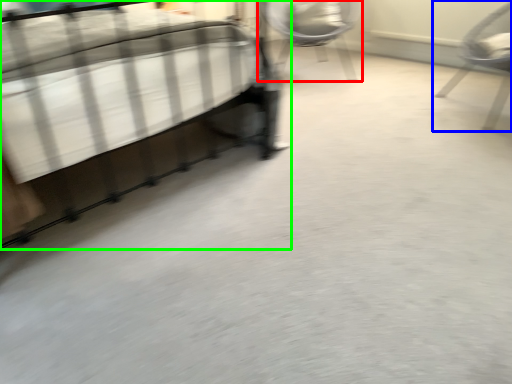
Question: Considering the real-world distances, which object is farthest from chair (highlighted by a red box)? chair (highlighted by a blue box) or bed (highlighted by a green box)?

Choices:
 (A) chair
 (B) bed

Answer: (B)